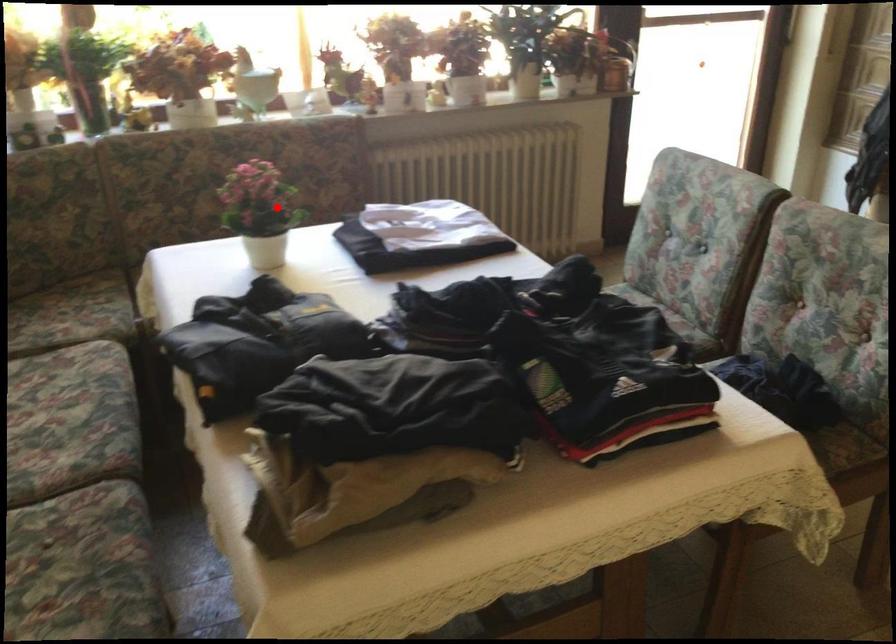
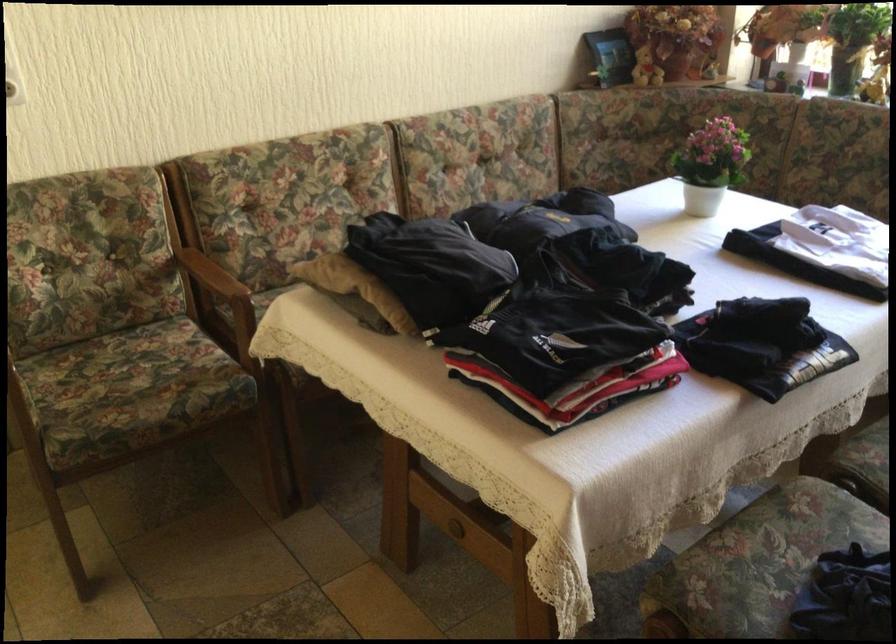
Question: I am providing you with two images of the same scene from different viewpoints. A red point is marked on the first image. Is the red point's position out of view in image 2?

Choices:
 (A) Yes
 (B) No

Answer: (B)